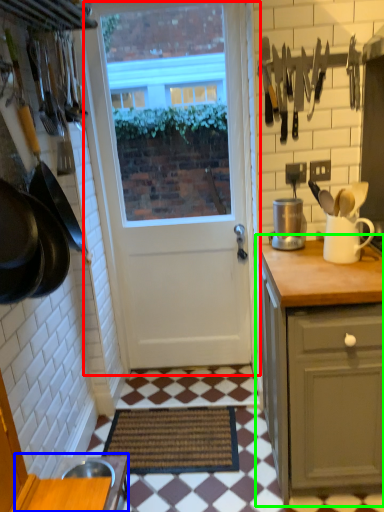
Question: Estimate the real-world distances between objects in this image. Which object is farther from door (highlighted by a red box), table (highlighted by a blue box) or cabinetry (highlighted by a green box)?

Choices:
 (A) table
 (B) cabinetry

Answer: (A)